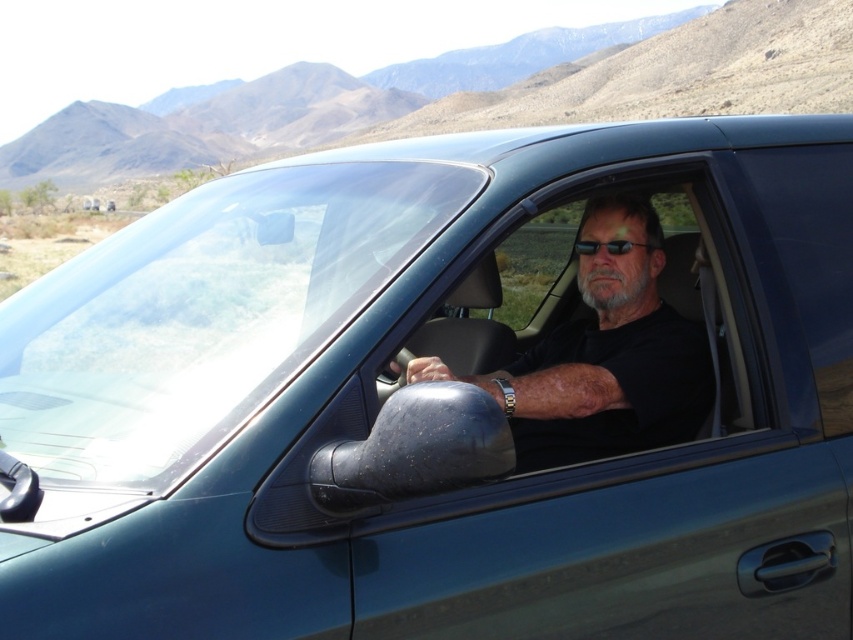
Does black matte shirt at center have a greater width compared to black plastic sunglasses at center?

Correct, the width of black matte shirt at center exceeds that of black plastic sunglasses at center.

Is black matte shirt at center positioned behind black plastic sunglasses at center?

No, black matte shirt at center is in front of black plastic sunglasses at center.

Between point (683, 404) and point (647, 244), which one is positioned behind?

Point (647, 244)

Find the location of a particular element. This screenshot has width=853, height=640. black matte shirt at center is located at coordinates (602, 356).

Does transparent glass window at center have a larger size compared to black matte shirt at center?

Indeed, transparent glass window at center has a larger size compared to black matte shirt at center.

Image resolution: width=853 pixels, height=640 pixels. Find the location of `transparent glass window at center`. transparent glass window at center is located at coordinates (543, 365).

Is transparent glass window at center bigger than black plastic sunglasses at center?

Indeed, transparent glass window at center has a larger size compared to black plastic sunglasses at center.

Does point (454, 321) come farther from viewer compared to point (645, 244)?

Yes, it is behind point (645, 244).

Is point (505, 372) positioned before point (583, 244)?

No, (505, 372) is behind (583, 244).

What are the coordinates of `transparent glass window at center` in the screenshot? It's located at (543, 365).